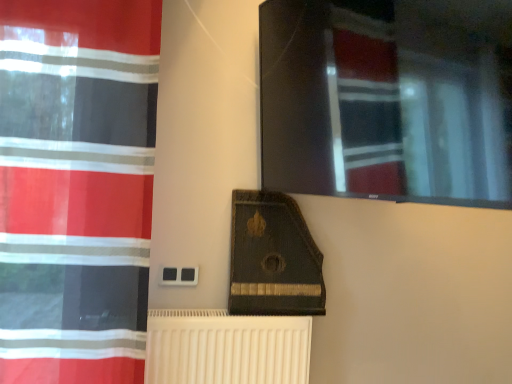
Question: Is white ribbed radiator at lower center further to camera compared to red striped curtain at left?

Choices:
 (A) yes
 (B) no

Answer: (A)

Question: From the image's perspective, would you say white ribbed radiator at lower center is shown under red striped curtain at left?

Choices:
 (A) no
 (B) yes

Answer: (B)

Question: Would you consider white ribbed radiator at lower center to be distant from red striped curtain at left?

Choices:
 (A) no
 (B) yes

Answer: (A)

Question: From the image's perspective, is white ribbed radiator at lower center located above red striped curtain at left?

Choices:
 (A) yes
 (B) no

Answer: (B)

Question: Is white ribbed radiator at lower center shorter than red striped curtain at left?

Choices:
 (A) yes
 (B) no

Answer: (A)

Question: Considering the relative sizes of white ribbed radiator at lower center and red striped curtain at left in the image provided, is white ribbed radiator at lower center bigger than red striped curtain at left?

Choices:
 (A) no
 (B) yes

Answer: (A)

Question: Is red striped curtain at left oriented away from white ribbed radiator at lower center?

Choices:
 (A) no
 (B) yes

Answer: (A)

Question: Can you confirm if red striped curtain at left is thinner than white ribbed radiator at lower center?

Choices:
 (A) yes
 (B) no

Answer: (A)

Question: Does red striped curtain at left lie behind white ribbed radiator at lower center?

Choices:
 (A) no
 (B) yes

Answer: (A)

Question: From the image's perspective, is red striped curtain at left located beneath white ribbed radiator at lower center?

Choices:
 (A) yes
 (B) no

Answer: (B)

Question: Is red striped curtain at left not inside white ribbed radiator at lower center?

Choices:
 (A) no
 (B) yes

Answer: (B)

Question: Considering the relative sizes of red striped curtain at left and white ribbed radiator at lower center in the image provided, is red striped curtain at left shorter than white ribbed radiator at lower center?

Choices:
 (A) yes
 (B) no

Answer: (B)

Question: Would you say white ribbed radiator at lower center is inside or outside red striped curtain at left?

Choices:
 (A) inside
 (B) outside

Answer: (B)